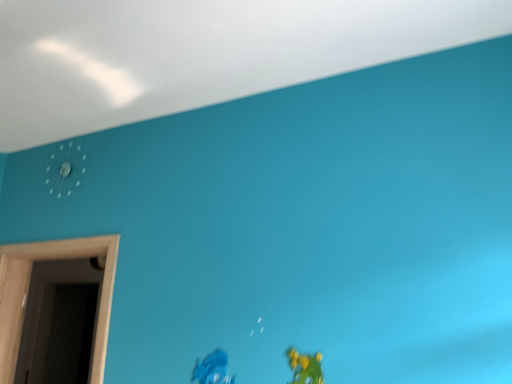
Question: Visually, is wooden door at left positioned to the left or to the right of matte blue toy at lower center, arranged as the second toy when viewed from the front?

Choices:
 (A) left
 (B) right

Answer: (A)

Question: From the image's perspective, is wooden door at left positioned above or below matte blue toy at lower center, arranged as the second toy when viewed from the front?

Choices:
 (A) below
 (B) above

Answer: (B)

Question: Which of these objects is positioned closest to the matte green toy at lower right, the second toy in the back-to-front sequence?

Choices:
 (A) white plastic clock at upper left
 (B) matte blue toy at lower center, the 2th toy when ordered from right to left
 (C) wooden door at left

Answer: (B)

Question: Which of these objects is positioned closest to the white plastic clock at upper left?

Choices:
 (A) matte green toy at lower right, which is counted as the first toy, starting from the right
 (B) wooden door at left
 (C) matte blue toy at lower center, the 2th toy when ordered from right to left

Answer: (B)